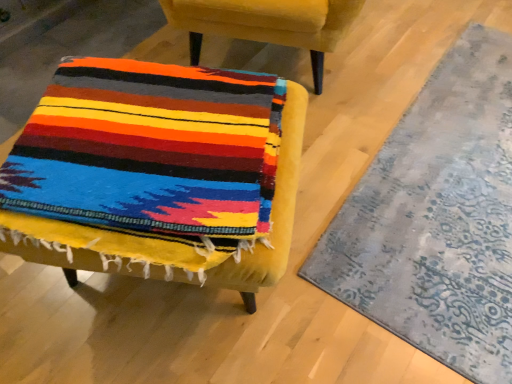
Question: Is velvet yellow chair at center, marked as the 1th chair in a bottom-to-top arrangement, located within velvet yellow chair at lower left, the 2th chair in the bottom-to-top sequence?

Choices:
 (A) yes
 (B) no

Answer: (B)

Question: Considering the relative sizes of velvet yellow chair at lower left, which is the first chair in top-to-bottom order, and velvet yellow chair at center, arranged as the second chair when viewed from the top, in the image provided, is velvet yellow chair at lower left, which is the first chair in top-to-bottom order, shorter than velvet yellow chair at center, arranged as the second chair when viewed from the top,?

Choices:
 (A) no
 (B) yes

Answer: (A)

Question: Considering the relative positions of velvet yellow chair at lower left, which is the first chair in top-to-bottom order, and velvet yellow chair at center, marked as the 1th chair in a bottom-to-top arrangement, in the image provided, is velvet yellow chair at lower left, which is the first chair in top-to-bottom order, in front of velvet yellow chair at center, marked as the 1th chair in a bottom-to-top arrangement,?

Choices:
 (A) yes
 (B) no

Answer: (B)

Question: Considering the relative positions of velvet yellow chair at lower left, which is the first chair in top-to-bottom order, and velvet yellow chair at center, arranged as the second chair when viewed from the top, in the image provided, is velvet yellow chair at lower left, which is the first chair in top-to-bottom order, to the left of velvet yellow chair at center, arranged as the second chair when viewed from the top, from the viewer's perspective?

Choices:
 (A) yes
 (B) no

Answer: (B)

Question: Is velvet yellow chair at lower left, which is the first chair in top-to-bottom order, not close to velvet yellow chair at center, arranged as the second chair when viewed from the top?

Choices:
 (A) yes
 (B) no

Answer: (B)

Question: Considering the relative sizes of velvet yellow chair at lower left, the 2th chair in the bottom-to-top sequence, and velvet yellow chair at center, marked as the 1th chair in a bottom-to-top arrangement, in the image provided, is velvet yellow chair at lower left, the 2th chair in the bottom-to-top sequence, taller than velvet yellow chair at center, marked as the 1th chair in a bottom-to-top arrangement,?

Choices:
 (A) no
 (B) yes

Answer: (B)

Question: Does velvet yellow chair at center, arranged as the second chair when viewed from the top, turn towards velvet yellow chair at lower left, which is the first chair in top-to-bottom order?

Choices:
 (A) yes
 (B) no

Answer: (B)

Question: Are velvet yellow chair at center, marked as the 1th chair in a bottom-to-top arrangement, and velvet yellow chair at lower left, which is the first chair in top-to-bottom order, making contact?

Choices:
 (A) no
 (B) yes

Answer: (A)

Question: Considering the relative sizes of velvet yellow chair at center, arranged as the second chair when viewed from the top, and velvet yellow chair at lower left, which is the first chair in top-to-bottom order, in the image provided, is velvet yellow chair at center, arranged as the second chair when viewed from the top, thinner than velvet yellow chair at lower left, which is the first chair in top-to-bottom order,?

Choices:
 (A) no
 (B) yes

Answer: (B)

Question: Is velvet yellow chair at center, arranged as the second chair when viewed from the top, turned away from velvet yellow chair at lower left, the 2th chair in the bottom-to-top sequence?

Choices:
 (A) no
 (B) yes

Answer: (A)

Question: Is the depth of velvet yellow chair at center, marked as the 1th chair in a bottom-to-top arrangement, greater than that of velvet yellow chair at lower left, which is the first chair in top-to-bottom order?

Choices:
 (A) yes
 (B) no

Answer: (B)

Question: Can you confirm if velvet yellow chair at center, arranged as the second chair when viewed from the top, is smaller than velvet yellow chair at lower left, the 2th chair in the bottom-to-top sequence?

Choices:
 (A) no
 (B) yes

Answer: (B)

Question: Can you confirm if velvet yellow chair at lower left, the 2th chair in the bottom-to-top sequence, is wider than textured gray rug at lower right?

Choices:
 (A) no
 (B) yes

Answer: (B)